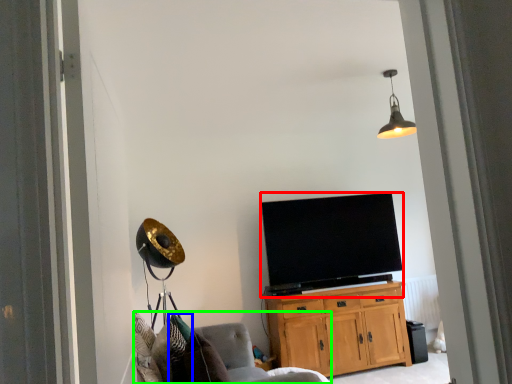
Question: Based on their relative distances, which object is farther from television (highlighted by a red box)? Choose from pillow (highlighted by a blue box) and chair (highlighted by a green box).

Choices:
 (A) pillow
 (B) chair

Answer: (A)